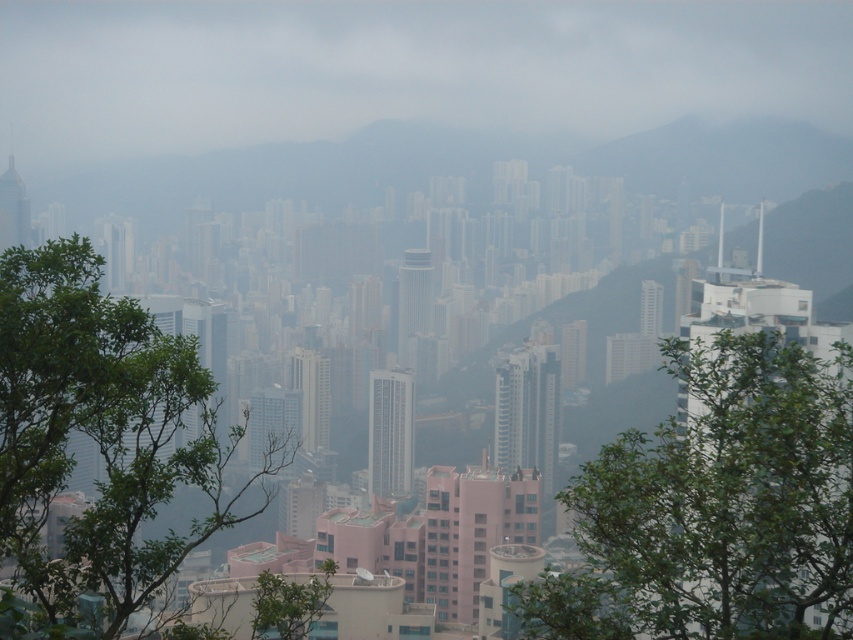
Question: Which point is closer to the camera?

Choices:
 (A) green leafy tree at left
 (B) green leafy tree at center

Answer: (A)

Question: Is green leafy tree at center wider than green leafy tree at left?

Choices:
 (A) yes
 (B) no

Answer: (A)

Question: Does green leafy tree at center appear over green leafy tree at left?

Choices:
 (A) no
 (B) yes

Answer: (A)

Question: Is green leafy tree at center wider than green leafy tree at left?

Choices:
 (A) no
 (B) yes

Answer: (B)